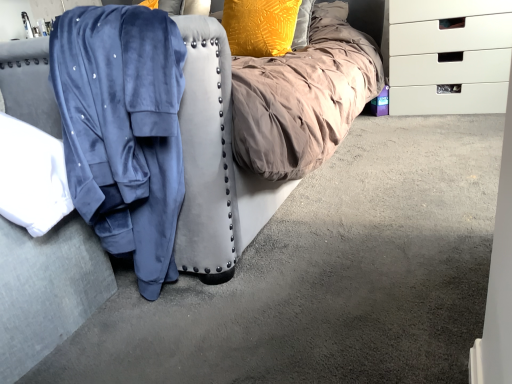
Question: Is white plastic chest of drawers at right oriented towards textured yellow pillow at upper center?

Choices:
 (A) no
 (B) yes

Answer: (A)

Question: Is white plastic chest of drawers at right in contact with textured yellow pillow at upper center?

Choices:
 (A) yes
 (B) no

Answer: (B)

Question: Is white plastic chest of drawers at right taller than textured yellow pillow at upper center?

Choices:
 (A) no
 (B) yes

Answer: (B)

Question: From the image's perspective, does white plastic chest of drawers at right appear lower than textured yellow pillow at upper center?

Choices:
 (A) no
 (B) yes

Answer: (B)

Question: From a real-world perspective, is white plastic chest of drawers at right on textured yellow pillow at upper center?

Choices:
 (A) yes
 (B) no

Answer: (B)

Question: Looking at the image, does white plastic chest of drawers at right seem bigger or smaller compared to textured yellow pillow at upper center?

Choices:
 (A) small
 (B) big

Answer: (B)

Question: In terms of width, does white plastic chest of drawers at right look wider or thinner when compared to textured yellow pillow at upper center?

Choices:
 (A) wide
 (B) thin

Answer: (A)

Question: Is white plastic chest of drawers at right taller or shorter than textured yellow pillow at upper center?

Choices:
 (A) short
 (B) tall

Answer: (B)

Question: Does point (457, 11) appear closer or farther from the camera than point (247, 16)?

Choices:
 (A) closer
 (B) farther

Answer: (A)

Question: In terms of width, does velvet blue robe at left look wider or thinner when compared to white plastic chest of drawers at right?

Choices:
 (A) wide
 (B) thin

Answer: (A)

Question: Is velvet blue robe at left to the left or to the right of white plastic chest of drawers at right in the image?

Choices:
 (A) left
 (B) right

Answer: (A)

Question: Is velvet blue robe at left situated inside white plastic chest of drawers at right or outside?

Choices:
 (A) inside
 (B) outside

Answer: (B)

Question: Relative to white plastic chest of drawers at right, is velvet blue robe at left in front or behind?

Choices:
 (A) behind
 (B) front

Answer: (B)

Question: From the image's perspective, is velvet blue robe at left located above or below velvet blue robe at left?

Choices:
 (A) below
 (B) above

Answer: (B)

Question: Considering their positions, is velvet blue robe at left located in front of or behind velvet blue robe at left?

Choices:
 (A) front
 (B) behind

Answer: (B)